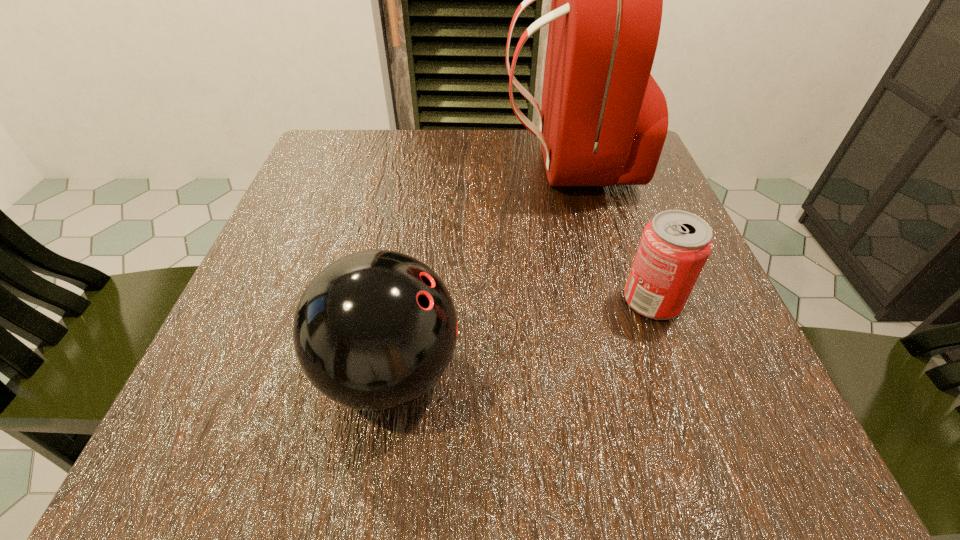
The width and height of the screenshot is (960, 540). I want to click on object that is at the far edge, so click(x=603, y=121).

Locate an element on the screen. object present at the near edge is located at coordinates (374, 330).

You are a GUI agent. You are given a task and a screenshot of the screen. Output one action in this format:
    pyautogui.click(x=<x>, y=<y>)
    Task: Click on the object present at the left edge
    This screenshot has height=540, width=960.
    Given the screenshot: What is the action you would take?
    pyautogui.click(x=374, y=330)

Where is `backpack present at the right edge`? Image resolution: width=960 pixels, height=540 pixels. backpack present at the right edge is located at coordinates (603, 121).

I want to click on soda can located at the right edge, so click(675, 245).

At what (x,y) coordinates should I click in order to perform the action: click on object at the near left corner. Please return your answer as a coordinate pair (x, y). This screenshot has height=540, width=960. Looking at the image, I should click on (374, 330).

Identify the location of object that is at the far right corner. 603,121.

The image size is (960, 540). What are the coordinates of `free space at the far edge of the desktop` in the screenshot? It's located at coord(422,158).

What are the coordinates of `vacant space at the near edge` in the screenshot? It's located at (588, 454).

Find the location of a particular element. free space at the left edge is located at coordinates (290, 256).